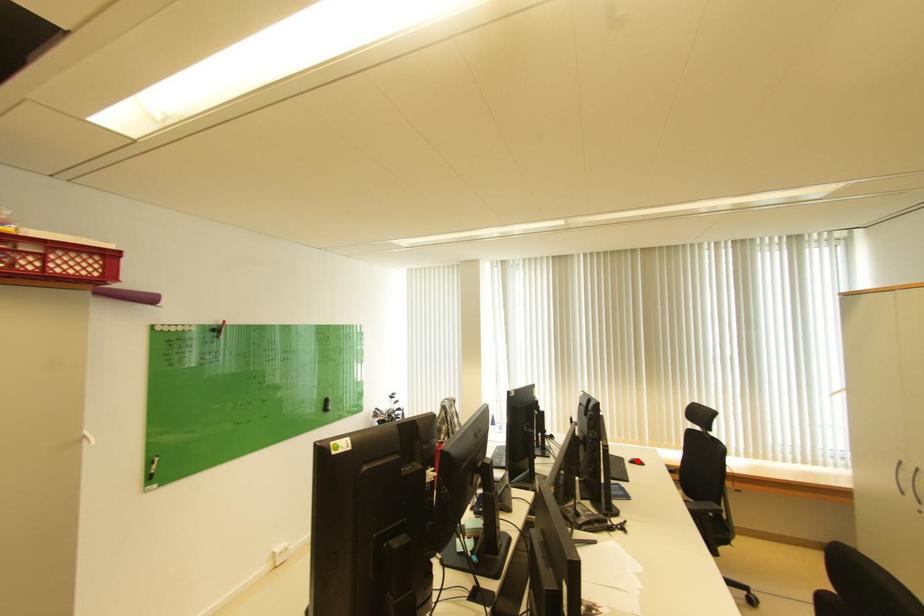
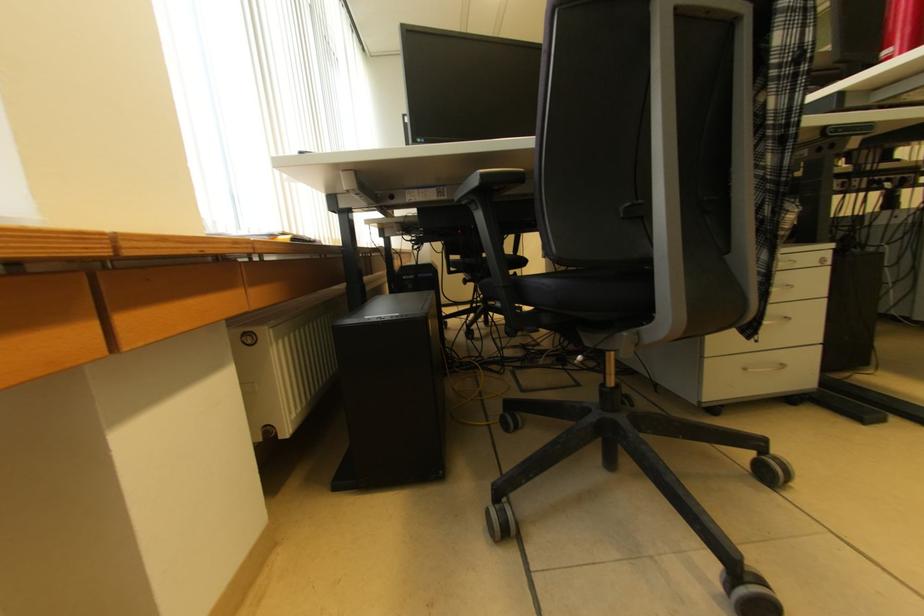
Question: I am providing you with two images of the same scene from different viewpoints. A red point is marked on the first image. Is the red point's position out of view in image 2?

Choices:
 (A) Yes
 (B) No

Answer: (A)